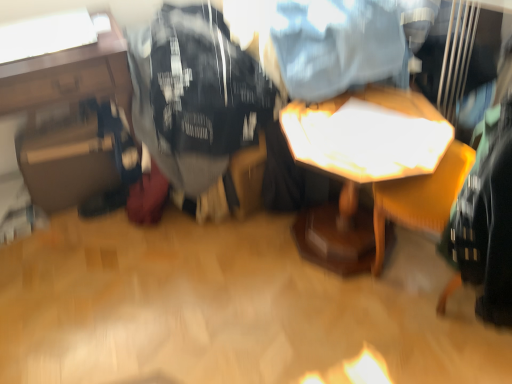
Identify the location of vacant space in front of wooden table at center, the second table in the left-to-right sequence. The width and height of the screenshot is (512, 384). (348, 337).